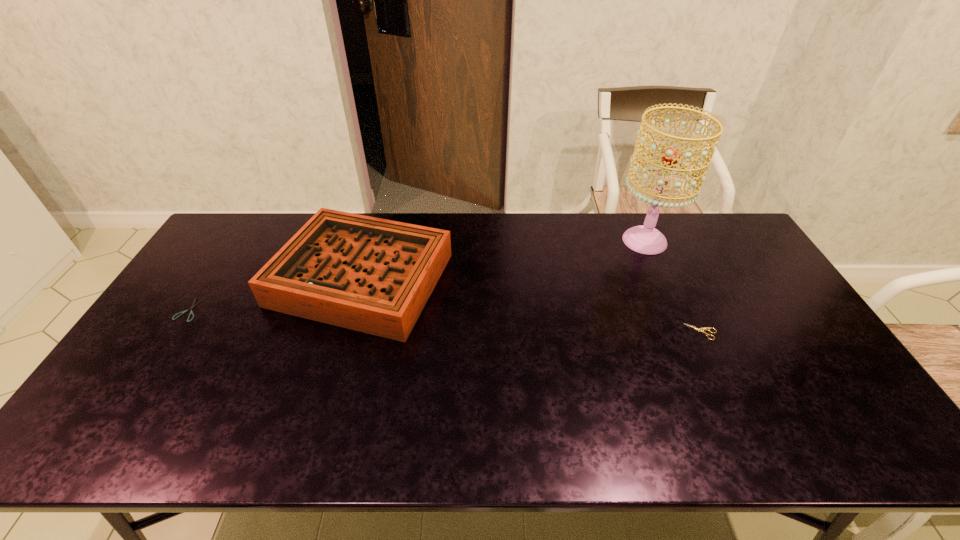
You are a GUI agent. You are given a task and a screenshot of the screen. Output one action in this format:
    pyautogui.click(x=<x>, y=<y>)
    Task: Click on the tallest object
    
    Given the screenshot: What is the action you would take?
    pyautogui.click(x=646, y=239)

The width and height of the screenshot is (960, 540). Identify the location of gameboard. (372, 275).

Where is `the third shortest object`? the third shortest object is located at coordinates (372, 275).

Find the location of `the taller shears`. the taller shears is located at coordinates (705, 328).

Find the location of a particular element. The image size is (960, 540). the nearer shears is located at coordinates click(x=705, y=328).

I want to click on the left shears, so click(x=191, y=312).

This screenshot has height=540, width=960. Find the location of `the farther shears`. the farther shears is located at coordinates (191, 312).

At what (x,y) coordinates should I click in order to perform the action: click on free space located on the left of the tallest object. Please return your answer as a coordinate pair (x, y). Looking at the image, I should click on (599, 241).

You are a GUI agent. You are given a task and a screenshot of the screen. Output one action in this format:
    pyautogui.click(x=<x>, y=<y>)
    Task: Click on the free space located 0.190m on the left of the third shortest object
    
    Given the screenshot: What is the action you would take?
    pyautogui.click(x=215, y=278)

The image size is (960, 540). I want to click on free space located on the left of the taller shears, so click(x=569, y=332).